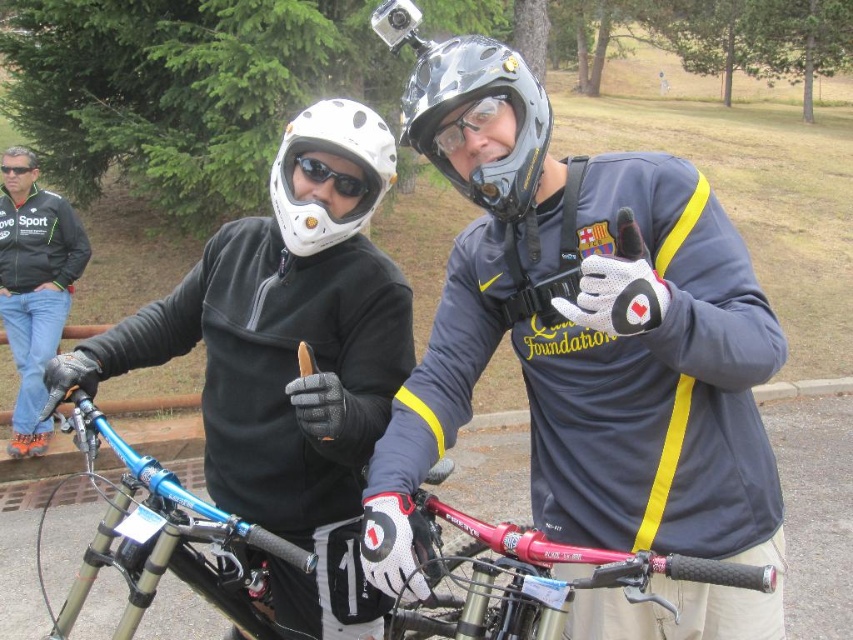
Is matte black helmet at upper center to the right of black matte goggles at upper left from the viewer's perspective?

Correct, you'll find matte black helmet at upper center to the right of black matte goggles at upper left.

Can you confirm if matte black helmet at upper center is positioned to the left of black matte goggles at upper left?

No, matte black helmet at upper center is not to the left of black matte goggles at upper left.

Which is behind, point (454, 285) or point (28, 170)?

Positioned behind is point (28, 170).

In order to click on matte black helmet at upper center in this screenshot , I will do `click(582, 332)`.

Which is more to the left, black matte helmet at center or transparent plastic goggles at upper center?

From the viewer's perspective, black matte helmet at center appears more on the left side.

Can you confirm if black matte helmet at center is positioned to the right of transparent plastic goggles at upper center?

No, black matte helmet at center is not to the right of transparent plastic goggles at upper center.

Where is `black matte helmet at center`? This screenshot has width=853, height=640. black matte helmet at center is located at coordinates (469, 100).

In the scene shown: Who is more distant from viewer, (281, 193) or (352, 173)?

Positioned behind is point (281, 193).

Between white matte helmet at upper left and black matte goggles at center, which one has more height?

Standing taller between the two is white matte helmet at upper left.

Does point (360, 122) come in front of point (364, 188)?

Yes, point (360, 122) is closer to viewer.

This screenshot has width=853, height=640. In order to click on white matte helmet at upper left in this screenshot , I will do `click(332, 152)`.